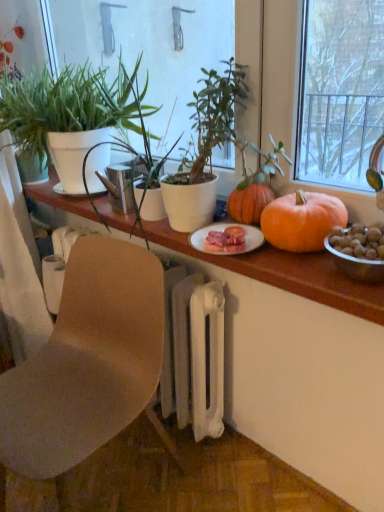
The width and height of the screenshot is (384, 512). Describe the element at coordinates (302, 220) in the screenshot. I see `orange matte pumpkin at center` at that location.

Measure the distance between point (164, 229) and camera.

They are 1.20 meters apart.

Find the location of a particular element. The height and width of the screenshot is (512, 384). brown matte chair at lower left is located at coordinates tap(85, 372).

The width and height of the screenshot is (384, 512). I want to click on orange matte pumpkin at center, so click(x=302, y=220).

Is wooden table at center aimed at brown matte chair at lower left?

No, wooden table at center is not aimed at brown matte chair at lower left.

Can you confirm if wooden table at center is taller than brown matte chair at lower left?

Incorrect, the height of wooden table at center is not larger of that of brown matte chair at lower left.

Find the location of a particular element. table lying behind the brown matte chair at lower left is located at coordinates (287, 273).

From the image's perspective, which object appears higher, wooden table at center or brown matte chair at lower left?

wooden table at center appears higher in the image.

In the image, is green matte plant at left, positioned as the 2th houseplant in right-to-left order, positioned in front of or behind brown matte chair at lower left?

green matte plant at left, positioned as the 2th houseplant in right-to-left order, is positioned farther from the viewer than brown matte chair at lower left.

Who is shorter, green matte plant at left, acting as the 1th houseplant starting from the left, or brown matte chair at lower left?

Standing shorter between the two is green matte plant at left, acting as the 1th houseplant starting from the left.

Find the location of a particular element. chair below the green matte plant at left, positioned as the 2th houseplant in right-to-left order (from a real-world perspective) is located at coordinates pyautogui.click(x=85, y=372).

From the image's perspective, is green matte plant at left, acting as the 1th houseplant starting from the left, above or below brown matte chair at lower left?

green matte plant at left, acting as the 1th houseplant starting from the left, is situated higher than brown matte chair at lower left in the image.

Are brown matte chair at lower left and green matte plant at left, acting as the 1th houseplant starting from the left, located far from each other?

brown matte chair at lower left is actually quite close to green matte plant at left, acting as the 1th houseplant starting from the left.

Looking at this image, considering the sizes of brown matte chair at lower left and green matte plant at left, acting as the 1th houseplant starting from the left, in the image, is brown matte chair at lower left wider or thinner than green matte plant at left, acting as the 1th houseplant starting from the left,?

Considering their sizes, brown matte chair at lower left looks broader than green matte plant at left, acting as the 1th houseplant starting from the left.

Who is more distant, brown matte chair at lower left or green matte plant at left, acting as the 1th houseplant starting from the left?

green matte plant at left, acting as the 1th houseplant starting from the left, is behind.

From the image's perspective, which is below, orange matte pumpkin at center or wooden table at center?

orange matte pumpkin at center.

Considering the positions of objects orange matte pumpkin at center and wooden table at center in the image provided, who is more to the right, orange matte pumpkin at center or wooden table at center?

From the viewer's perspective, orange matte pumpkin at center appears more on the right side.

Based on the photo, considering the relative sizes of orange matte pumpkin at center and wooden table at center in the image provided, is orange matte pumpkin at center bigger than wooden table at center?

No, orange matte pumpkin at center is not bigger than wooden table at center.

From the image's perspective, is orange matte pumpkin at center positioned above or below green matte plant at left, positioned as the 2th houseplant in right-to-left order?

Based on their image positions, orange matte pumpkin at center is located beneath green matte plant at left, positioned as the 2th houseplant in right-to-left order.

From the picture: Is orange matte pumpkin at center facing away from green matte plant at left, positioned as the 2th houseplant in right-to-left order?

No, orange matte pumpkin at center is not facing the opposite direction of green matte plant at left, positioned as the 2th houseplant in right-to-left order.

Based on the photo, does orange matte pumpkin at center contain green matte plant at left, positioned as the 2th houseplant in right-to-left order?

No, green matte plant at left, positioned as the 2th houseplant in right-to-left order, is not a part of orange matte pumpkin at center.

In the scene shown: From a real-world perspective, is orange matte pumpkin at center on top of green matte plant at left, acting as the 1th houseplant starting from the left?

Actually, orange matte pumpkin at center is physically below green matte plant at left, acting as the 1th houseplant starting from the left, in the real world.

From their relative heights in the image, would you say wooden table at center is taller or shorter than green matte plant at center, the 2th houseplant in the left-to-right sequence?

Considering their sizes, wooden table at center has less height than green matte plant at center, the 2th houseplant in the left-to-right sequence.

Which of these two, wooden table at center or green matte plant at center, which is counted as the 1th houseplant, starting from the right, is bigger?

With larger size is wooden table at center.

Looking at this image, is wooden table at center located outside green matte plant at center, the 2th houseplant in the left-to-right sequence?

Absolutely, wooden table at center is external to green matte plant at center, the 2th houseplant in the left-to-right sequence.

From a real-world perspective, is wooden table at center positioned under green matte plant at center, the 2th houseplant in the left-to-right sequence, based on gravity?

Yes, from a real-world perspective, wooden table at center is under green matte plant at center, the 2th houseplant in the left-to-right sequence.

How distant is green matte plant at center, which is counted as the 1th houseplant, starting from the right, from orange matte pumpkin at center?

green matte plant at center, which is counted as the 1th houseplant, starting from the right, and orange matte pumpkin at center are 19.23 inches apart from each other.

Considering the sizes of green matte plant at center, which is counted as the 1th houseplant, starting from the right, and orange matte pumpkin at center in the image, is green matte plant at center, which is counted as the 1th houseplant, starting from the right, wider or thinner than orange matte pumpkin at center?

Clearly, green matte plant at center, which is counted as the 1th houseplant, starting from the right, has more width compared to orange matte pumpkin at center.

Is green matte plant at center, the 2th houseplant in the left-to-right sequence, touching orange matte pumpkin at center?

green matte plant at center, the 2th houseplant in the left-to-right sequence, and orange matte pumpkin at center are clearly separated.

Which is correct: green matte plant at center, the 2th houseplant in the left-to-right sequence, is inside orange matte pumpkin at center, or outside of it?

green matte plant at center, the 2th houseplant in the left-to-right sequence, is outside orange matte pumpkin at center.

In order to click on chair on the left of wooden table at center in this screenshot , I will do `click(85, 372)`.

Where is `chair below the green matte plant at left, positioned as the 2th houseplant in right-to-left order (from the image's perspective)`? The image size is (384, 512). chair below the green matte plant at left, positioned as the 2th houseplant in right-to-left order (from the image's perspective) is located at coordinates (85, 372).

When comparing their distances from green matte plant at center, the 2th houseplant in the left-to-right sequence, does brown matte chair at lower left or orange matte pumpkin at center seem further?

Based on the image, orange matte pumpkin at center appears to be further to green matte plant at center, the 2th houseplant in the left-to-right sequence.

Based on their spatial positions, is green matte plant at center, the 2th houseplant in the left-to-right sequence, or brown matte chair at lower left further from green matte plant at left, positioned as the 2th houseplant in right-to-left order?

brown matte chair at lower left is further to green matte plant at left, positioned as the 2th houseplant in right-to-left order.

Looking at the image, which one is located further to orange matte pumpkin at center, green matte plant at left, positioned as the 2th houseplant in right-to-left order, or brown matte chair at lower left?

green matte plant at left, positioned as the 2th houseplant in right-to-left order, is further to orange matte pumpkin at center.

Considering their positions, is wooden table at center positioned further to brown matte chair at lower left than green matte plant at left, acting as the 1th houseplant starting from the left?

Based on the image, green matte plant at left, acting as the 1th houseplant starting from the left, appears to be further to brown matte chair at lower left.

Considering their positions, is orange matte pumpkin at center positioned closer to wooden table at center than green matte plant at left, positioned as the 2th houseplant in right-to-left order?

Based on the image, orange matte pumpkin at center appears to be nearer to wooden table at center.

Looking at the image, which one is located further to green matte plant at center, the 2th houseplant in the left-to-right sequence, green matte plant at left, positioned as the 2th houseplant in right-to-left order, or brown matte chair at lower left?

The object further to green matte plant at center, the 2th houseplant in the left-to-right sequence, is brown matte chair at lower left.

Looking at the image, which one is located closer to orange matte pumpkin at center, brown matte chair at lower left or wooden table at center?

Based on the image, wooden table at center appears to be nearer to orange matte pumpkin at center.

Looking at the image, which one is located further to brown matte chair at lower left, orange matte pumpkin at center or green matte plant at left, positioned as the 2th houseplant in right-to-left order?

orange matte pumpkin at center lies further to brown matte chair at lower left than the other object.

Find the location of `pumpkin between green matte plant at left, acting as the 1th houseplant starting from the left, and brown matte chair at lower left from top to bottom`. pumpkin between green matte plant at left, acting as the 1th houseplant starting from the left, and brown matte chair at lower left from top to bottom is located at coordinates (302, 220).

This screenshot has height=512, width=384. In order to click on table situated between green matte plant at left, positioned as the 2th houseplant in right-to-left order, and orange matte pumpkin at center from left to right in this screenshot , I will do `click(287, 273)`.

Identify the location of pumpkin between green matte plant at center, the 2th houseplant in the left-to-right sequence, and brown matte chair at lower left in the up-down direction. (302, 220).

Image resolution: width=384 pixels, height=512 pixels. Find the location of `table between green matte plant at left, acting as the 1th houseplant starting from the left, and brown matte chair at lower left vertically`. table between green matte plant at left, acting as the 1th houseplant starting from the left, and brown matte chair at lower left vertically is located at coordinates pos(287,273).